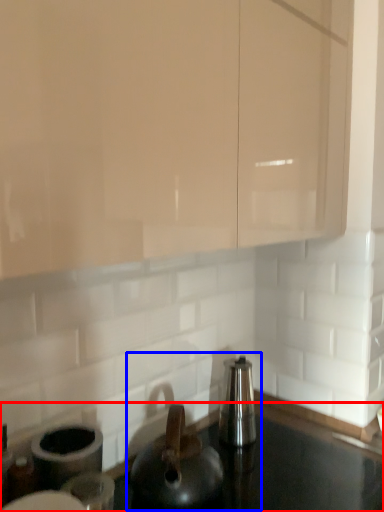
Question: Which of the following is the farthest to the observer, countertop (highlighted by a red box) or sink (highlighted by a blue box)?

Choices:
 (A) countertop
 (B) sink

Answer: (B)